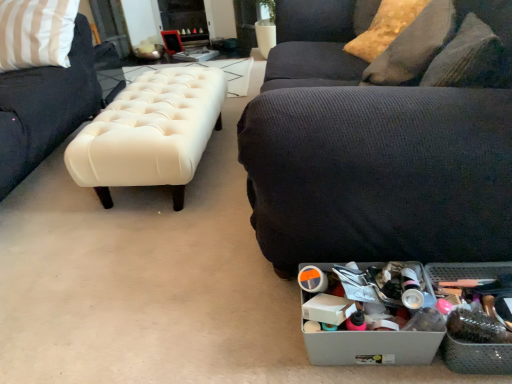
Question: Considering the relative sizes of metallic gray storage box at lower right, which is the 2th storage box from left to right, and creamy leather bench at center in the image provided, is metallic gray storage box at lower right, which is the 2th storage box from left to right, bigger than creamy leather bench at center?

Choices:
 (A) no
 (B) yes

Answer: (A)

Question: Is metallic gray storage box at lower right, the 1th storage box when ordered from right to left, positioned beyond the bounds of creamy leather bench at center?

Choices:
 (A) no
 (B) yes

Answer: (B)

Question: From the image's perspective, is metallic gray storage box at lower right, the 1th storage box when ordered from right to left, beneath creamy leather bench at center?

Choices:
 (A) yes
 (B) no

Answer: (A)

Question: Does metallic gray storage box at lower right, which is the 2th storage box from left to right, come in front of creamy leather bench at center?

Choices:
 (A) no
 (B) yes

Answer: (B)

Question: Are metallic gray storage box at lower right, which is the 2th storage box from left to right, and creamy leather bench at center far apart?

Choices:
 (A) yes
 (B) no

Answer: (A)

Question: From the image's perspective, is dark gray textured couch at lower right above or below shiny gold pillow at upper right, the second pillow ordered from the bottom?

Choices:
 (A) above
 (B) below

Answer: (B)

Question: From a real-world perspective, relative to shiny gold pillow at upper right, which is the first pillow from top to bottom, is dark gray textured couch at lower right vertically above or below?

Choices:
 (A) below
 (B) above

Answer: (A)

Question: Choose the correct answer: Is dark gray textured couch at lower right inside shiny gold pillow at upper right, which is the first pillow from top to bottom, or outside it?

Choices:
 (A) outside
 (B) inside

Answer: (A)

Question: Does point (481, 246) appear closer or farther from the camera than point (378, 41)?

Choices:
 (A) closer
 (B) farther

Answer: (A)

Question: Is point (389, 57) closer or farther from the camera than point (143, 155)?

Choices:
 (A) closer
 (B) farther

Answer: (A)

Question: Considering the positions of textured yellow pillow at upper right, which appears as the 2th pillow when viewed from the top, and creamy leather bench at center in the image, is textured yellow pillow at upper right, which appears as the 2th pillow when viewed from the top, taller or shorter than creamy leather bench at center?

Choices:
 (A) short
 (B) tall

Answer: (B)

Question: From a real-world perspective, relative to creamy leather bench at center, is textured yellow pillow at upper right, which appears as the 2th pillow when viewed from the top, vertically above or below?

Choices:
 (A) above
 (B) below

Answer: (A)

Question: Choose the correct answer: Is textured yellow pillow at upper right, which appears as the 2th pillow when viewed from the top, inside creamy leather bench at center or outside it?

Choices:
 (A) outside
 (B) inside

Answer: (A)

Question: Does point (390, 347) appear closer or farther from the camera than point (402, 9)?

Choices:
 (A) closer
 (B) farther

Answer: (A)

Question: In the image, is metallic gray storage box at lower right, which is the second storage box in right-to-left order, positioned in front of or behind shiny gold pillow at upper right, the second pillow ordered from the bottom?

Choices:
 (A) front
 (B) behind

Answer: (A)